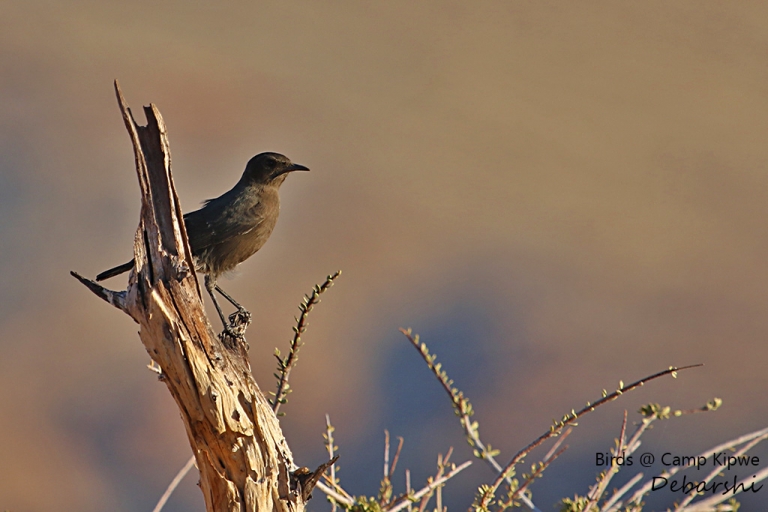
At what (x,y) coordinates should I click in order to perform the action: click on art piece. Please return your answer as a coordinate pair (x, y). This screenshot has height=512, width=768. Looking at the image, I should click on (256, 212).